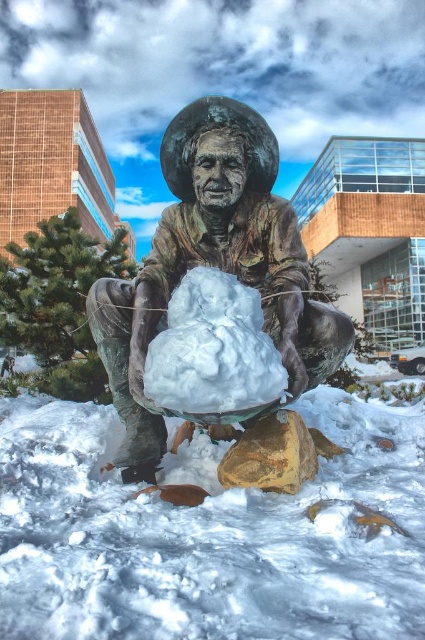
You are standing in front of the bronze statue in the snowy environment. You notice two points on the statue labeled as point (201,244) and point (232,340). Which of these points is closer to you?

Point (201,244) is further to the viewer than point (232,340). Therefore, point (232,340) is closer to you.

You are an artist planning to place a new sculpture in the snowy area. The new sculpture will be 2 meters tall. Considering the height of the existing objects, will the new sculpture be taller than both the white fluffy snow at center and the bronze statue at center?

The bronze statue at center is taller than the white fluffy snow at center. The new sculpture is 2 meters tall. However, without knowing the exact height of the bronze statue at center, we cannot determine if the new sculpture will be taller than both.

You are an artist planning to place a new sculpture in the same area as the bronze statue at center and the white fluffy snow at center. Considering their sizes, which object would you need to move to accommodate the new sculpture?

The bronze statue at center is smaller than the white fluffy snow at center, so you would need to move the bronze statue at center to make space for the new sculpture.